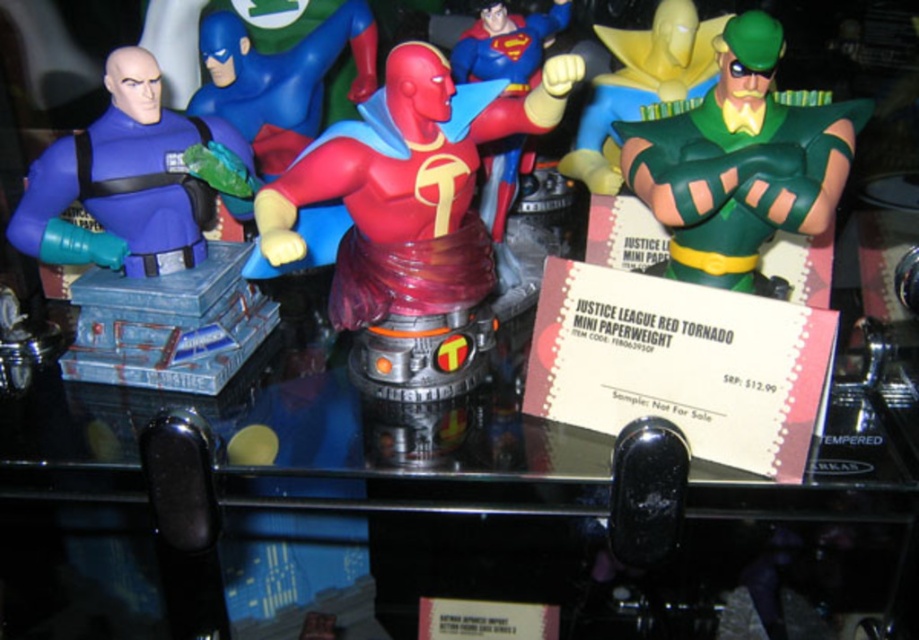
Is the position of green rubber mask at upper right more distant than that of translucent red figure at center?

No, it is in front of translucent red figure at center.

Who is positioned more to the right, green rubber mask at upper right or translucent red figure at center?

Positioned to the right is green rubber mask at upper right.

Identify the location of green rubber mask at upper right. This screenshot has height=640, width=919. (740, 161).

Who is positioned more to the left, translucent red bust at center or translucent red figure at center?

From the viewer's perspective, translucent red bust at center appears more on the left side.

The height and width of the screenshot is (640, 919). Describe the element at coordinates (409, 211) in the screenshot. I see `translucent red bust at center` at that location.

What do you see at coordinates (409, 211) in the screenshot? The height and width of the screenshot is (640, 919). I see `translucent red bust at center` at bounding box center [409, 211].

This screenshot has height=640, width=919. I want to click on translucent red bust at center, so click(409, 211).

Between point (448, 339) and point (135, 136), which one is positioned behind?

The point (135, 136) is more distant.

Can you confirm if translucent red bust at center is positioned to the right of matte blue plastic figure at left?

Yes, translucent red bust at center is to the right of matte blue plastic figure at left.

Locate an element on the screen. Image resolution: width=919 pixels, height=640 pixels. translucent red bust at center is located at coordinates coord(409,211).